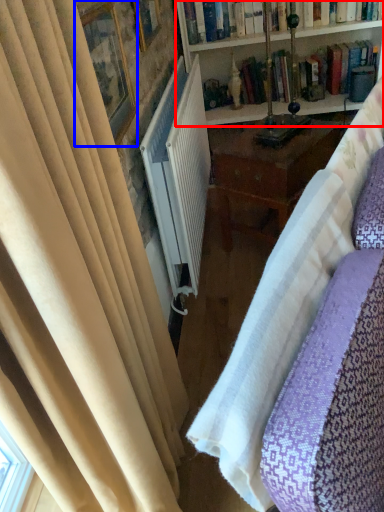
Question: Which object appears closest to the camera in this image, bookcase (highlighted by a red box) or picture frame (highlighted by a blue box)?

Choices:
 (A) bookcase
 (B) picture frame

Answer: (B)